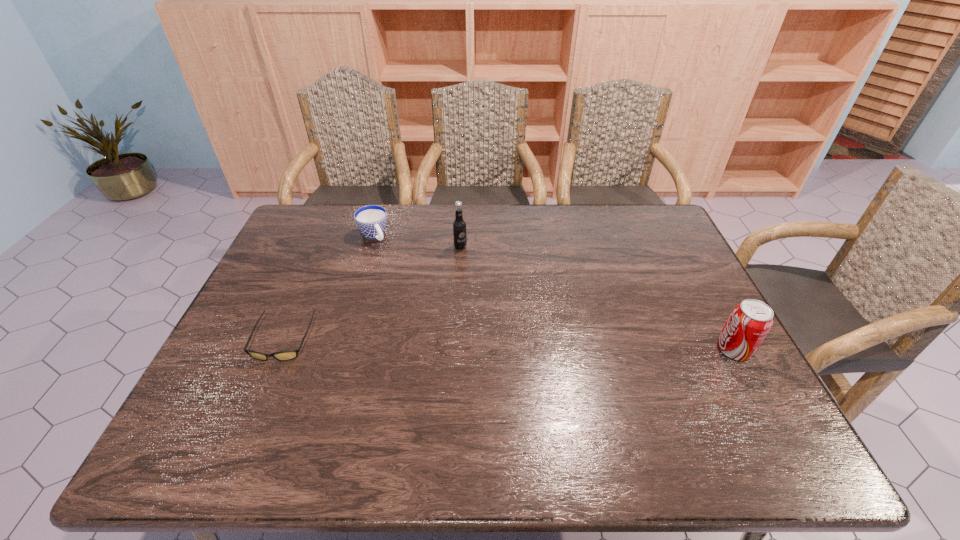
Find the location of a particular element. Image resolution: width=960 pixels, height=540 pixels. the leftmost object is located at coordinates (286, 355).

The image size is (960, 540). Identify the location of sunglasses. (286, 355).

In order to click on soda in this screenshot , I will do `click(750, 321)`.

At what (x,y) coordinates should I click in order to perform the action: click on the third shortest object. Please return your answer as a coordinate pair (x, y). This screenshot has width=960, height=540. Looking at the image, I should click on (750, 321).

The width and height of the screenshot is (960, 540). I want to click on cup, so click(x=371, y=220).

What are the coordinates of `the third object from right to left` in the screenshot? It's located at (371, 220).

Where is `the third object from left to right`? the third object from left to right is located at coordinates (459, 225).

Identify the location of free spot located 0.050m on the front-facing side of the sunglasses. Image resolution: width=960 pixels, height=540 pixels. (265, 382).

Image resolution: width=960 pixels, height=540 pixels. I want to click on vacant space positioned on the back of the rightmost object, so click(708, 301).

Identify the location of free space located 0.170m on the side of the second object from left to right with the handle. The image size is (960, 540). (401, 275).